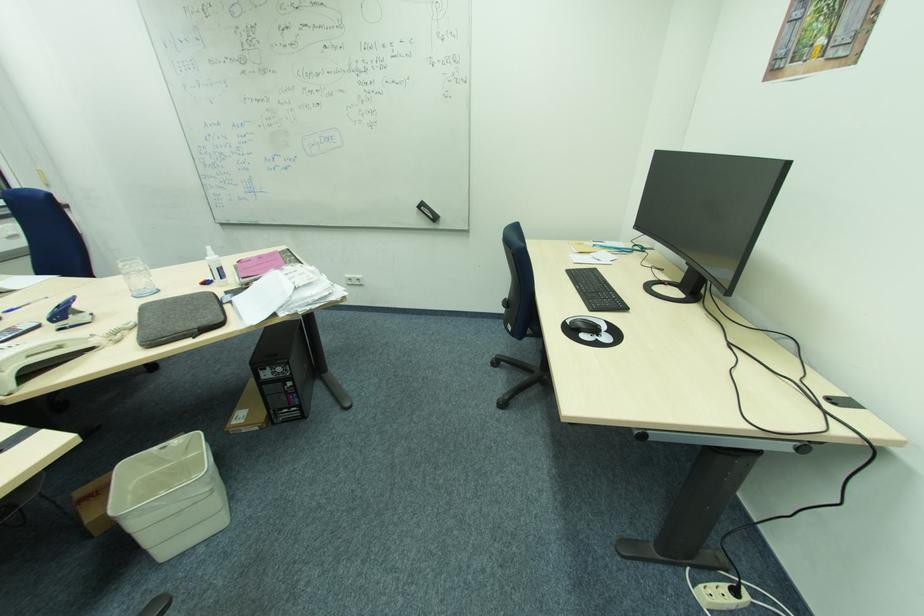
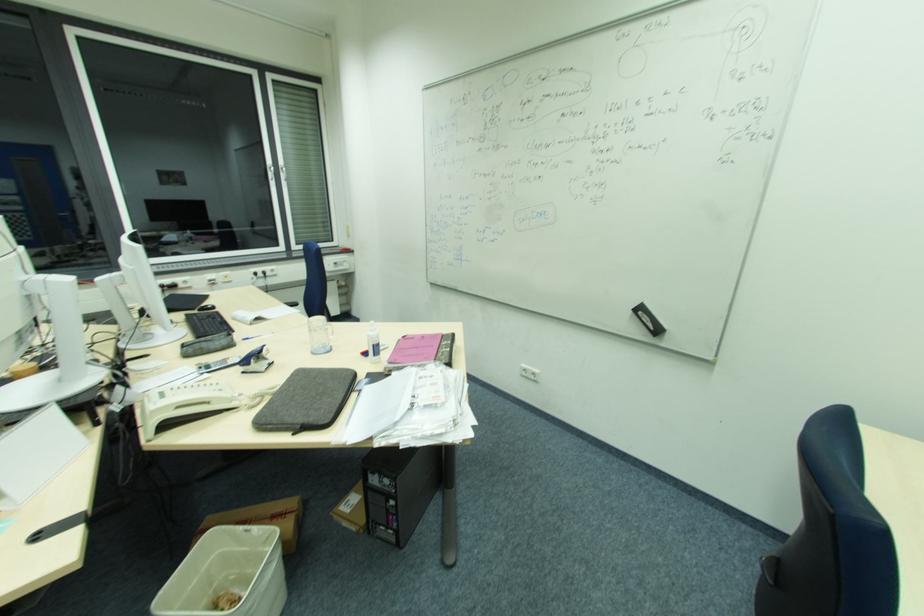
Where in the second image is the point corresponding to [64,347] from the first image?

(210, 403)